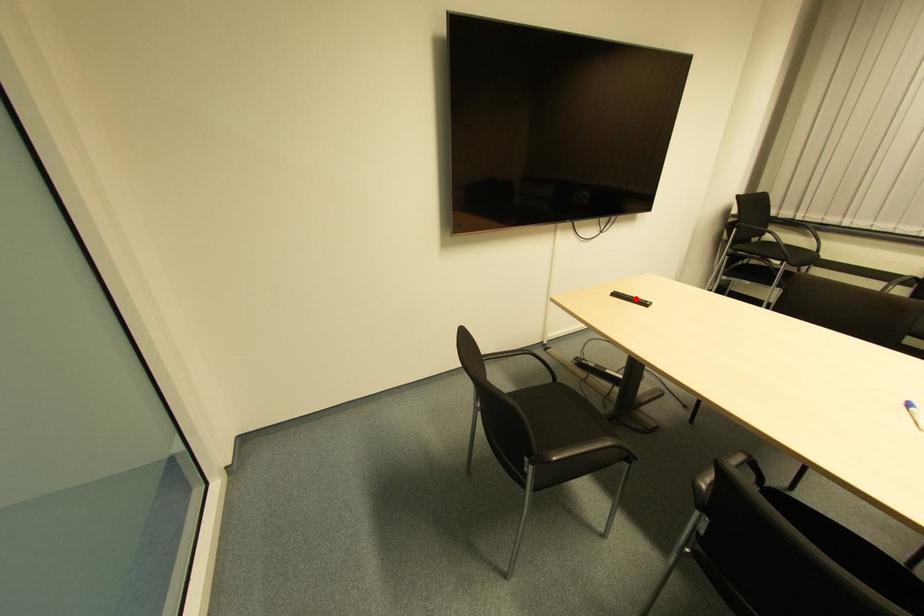
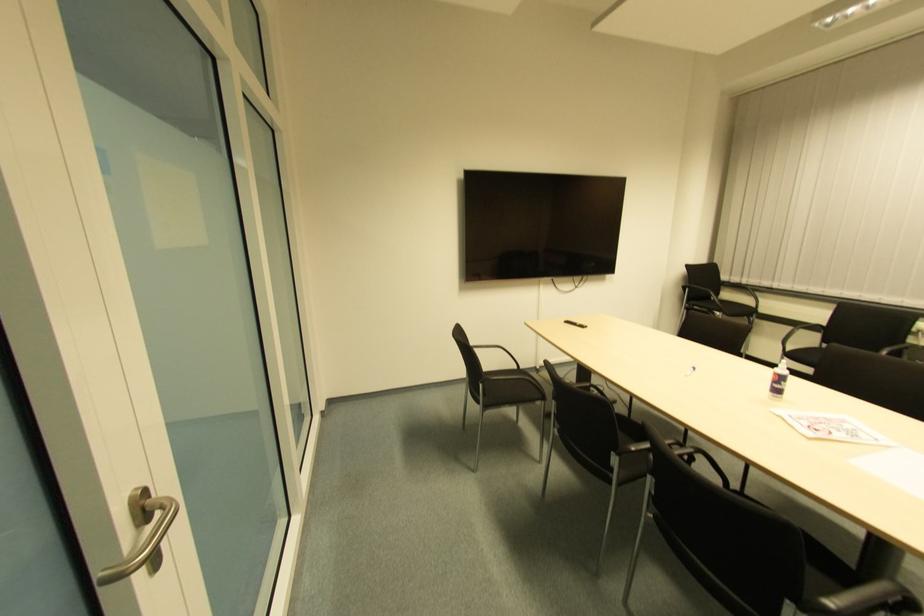
Question: I am providing you with two images of the same scene from different viewpoints. A red point is marked on the first image. Is the red point's position out of view in image 2?

Choices:
 (A) Yes
 (B) No

Answer: (B)